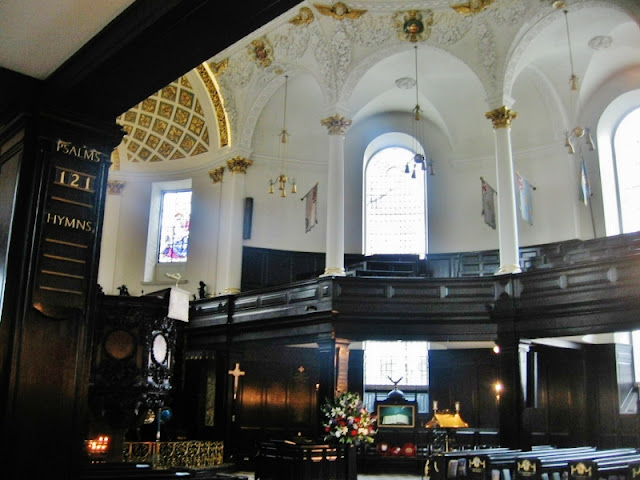
Image resolution: width=640 pixels, height=480 pixels. What are the coordinates of `arched windows` in the screenshot? It's located at (396, 198), (634, 153).